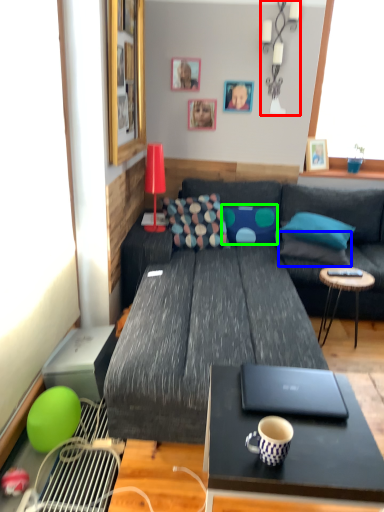
Question: Which object is the farthest from lamp (highlighted by a red box)? Choose among these: pillow (highlighted by a blue box) or pillow (highlighted by a green box).

Choices:
 (A) pillow
 (B) pillow

Answer: (A)